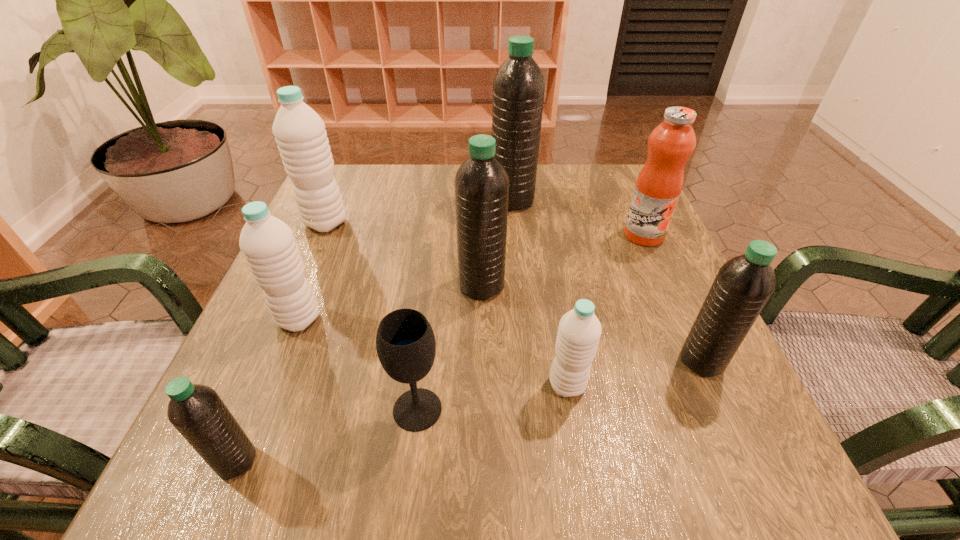
The image size is (960, 540). In the image, there is a desktop. Find the location of `free space at the far edge`. free space at the far edge is located at coordinates (563, 184).

Identify the location of vacant space at the near edge of the desktop. (588, 463).

This screenshot has width=960, height=540. Identify the location of free space at the left edge of the desktop. (309, 382).

In the image, there is a desktop. Where is `vacant space at the right edge`? vacant space at the right edge is located at coordinates (x=684, y=301).

At what (x,y) coordinates should I click in order to perform the action: click on free location at the far left corner of the desktop. Please return your answer as a coordinate pair (x, y). Looking at the image, I should click on (385, 183).

I want to click on vacant space at the far right corner, so click(573, 168).

You are a GUI agent. You are given a task and a screenshot of the screen. Output one action in this format:
    pyautogui.click(x=<x>, y=<y>)
    Task: Click on the vacant space at the near right corner
    The width and height of the screenshot is (960, 540).
    Given the screenshot: What is the action you would take?
    pyautogui.click(x=730, y=493)

The image size is (960, 540). What are the coordinates of `empty space that is in between the orange fruit juice and the rightmost black water bottle` in the screenshot? It's located at (673, 298).

The width and height of the screenshot is (960, 540). Identify the location of free space between the fourth nearest water bottle and the farthest white water bottle. (312, 271).

This screenshot has width=960, height=540. Find the location of `vacant space that is in between the third farthest black water bottle and the biggest black water bottle`. vacant space that is in between the third farthest black water bottle and the biggest black water bottle is located at coordinates (607, 281).